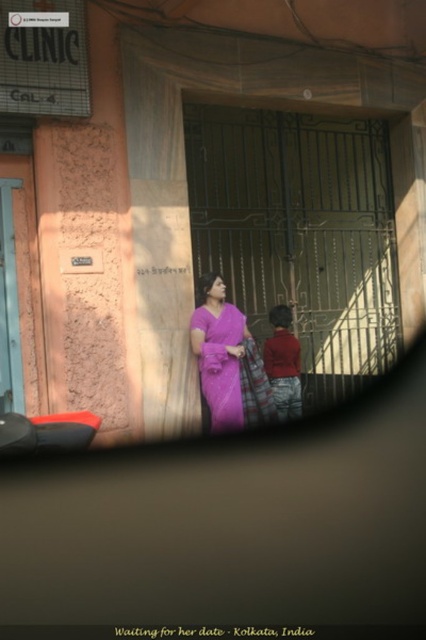
Question: Does purple silk saree at center have a lesser width compared to red cotton robe at center?

Choices:
 (A) yes
 (B) no

Answer: (B)

Question: Where is purple silk saree at center located in relation to red cotton robe at center in the image?

Choices:
 (A) below
 (B) above

Answer: (B)

Question: Which point is closer to the camera?

Choices:
 (A) (287, 394)
 (B) (204, 323)

Answer: (B)

Question: Which of the following is the closest to the observer?

Choices:
 (A) (290, 378)
 (B) (192, 317)

Answer: (B)

Question: Is purple silk saree at center thinner than red cotton robe at center?

Choices:
 (A) yes
 (B) no

Answer: (B)